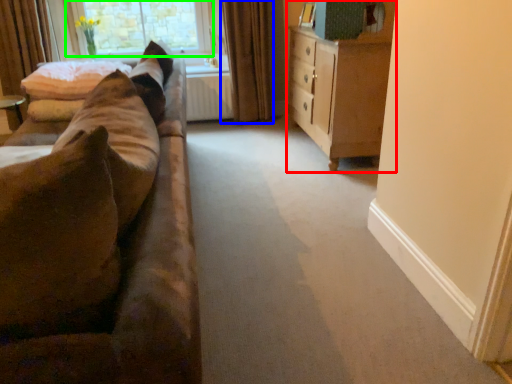
Question: Which object is positioned closest to cabinetry (highlighted by a red box)? Select from curtain (highlighted by a blue box) and window (highlighted by a green box).

Choices:
 (A) curtain
 (B) window

Answer: (A)